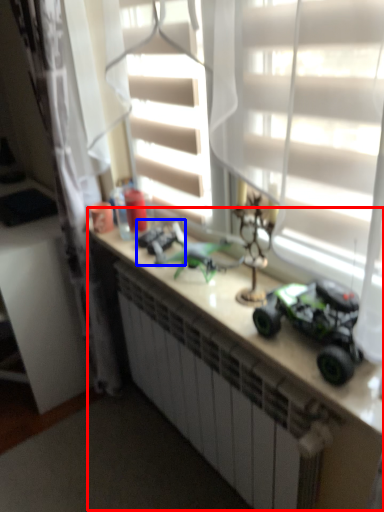
Question: Which of the following is the farthest to the observer, counter (highlighted by a red box) or toy (highlighted by a blue box)?

Choices:
 (A) counter
 (B) toy

Answer: (B)